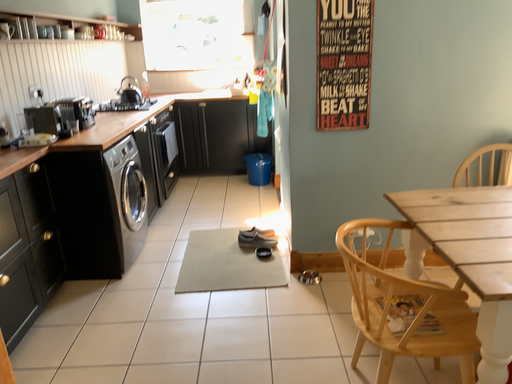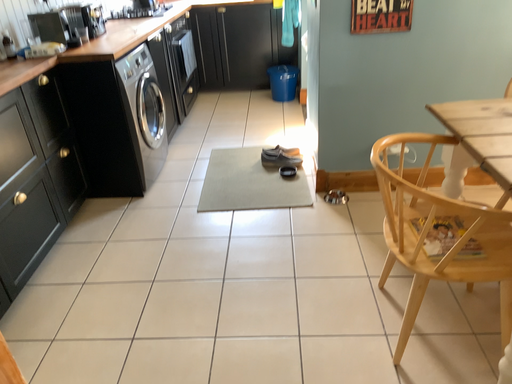
Question: How did the camera likely rotate when shooting the video?

Choices:
 (A) rotated downward
 (B) rotated upward

Answer: (A)